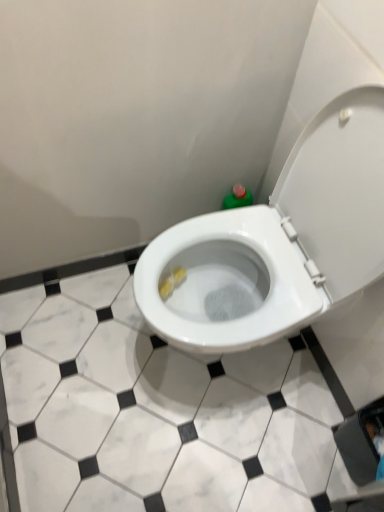
Question: In terms of size, does white glossy toilet at center appear bigger or smaller than white glossy tile at center?

Choices:
 (A) small
 (B) big

Answer: (B)

Question: Based on their positions, is white glossy toilet at center located to the left or right of white glossy tile at center?

Choices:
 (A) right
 (B) left

Answer: (A)

Question: Is white glossy toilet at center in front of or behind white glossy tile at center in the image?

Choices:
 (A) front
 (B) behind

Answer: (A)

Question: Choose the correct answer: Is white glossy tile at center inside white glossy toilet at center or outside it?

Choices:
 (A) outside
 (B) inside

Answer: (A)

Question: Is point (54, 368) positioned closer to the camera than point (334, 186)?

Choices:
 (A) farther
 (B) closer

Answer: (A)

Question: Based on their positions, is white glossy tile at center located to the left or right of white glossy toilet at center?

Choices:
 (A) left
 (B) right

Answer: (A)

Question: Considering the positions of white glossy tile at center and white glossy toilet at center in the image, is white glossy tile at center taller or shorter than white glossy toilet at center?

Choices:
 (A) short
 (B) tall

Answer: (A)